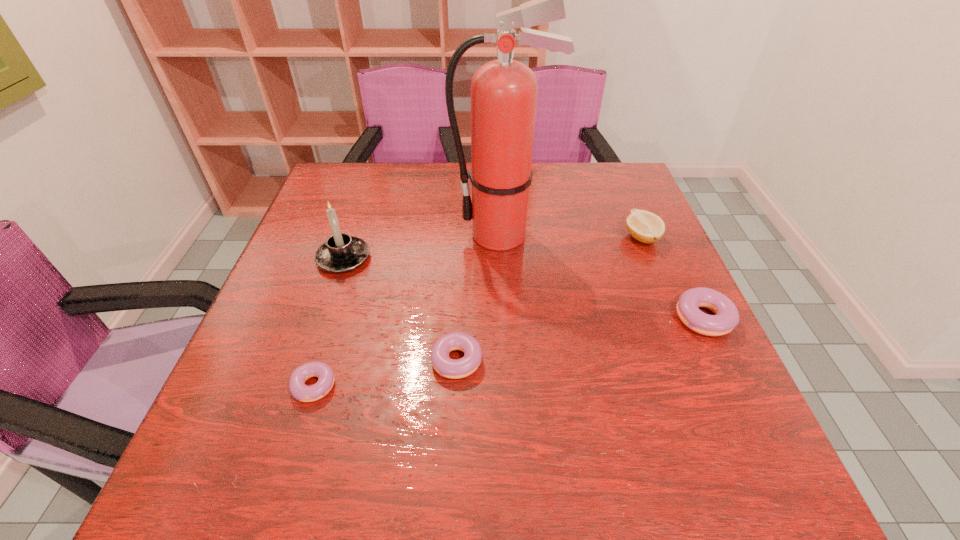
Please point a space for a new doughnut to maintain equal intervals. Please provide its 2D coordinates. Your answer should be formatted as a tuple, i.e. [(x, y)], where the tuple contains the x and y coordinates of a point satisfying the conditions above.

[(581, 339)]